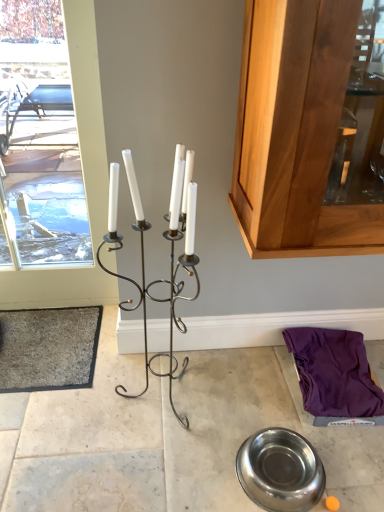
The width and height of the screenshot is (384, 512). I want to click on vacant space to the right of black wrought iron candle holder at center, so click(x=230, y=394).